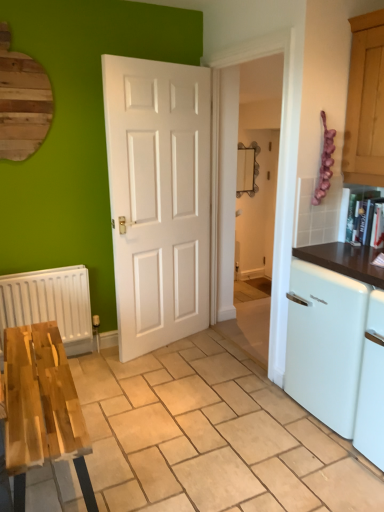
This screenshot has width=384, height=512. Describe the element at coordinates (325, 343) in the screenshot. I see `white glossy dishwasher at right` at that location.

Locate an element on the screen. The width and height of the screenshot is (384, 512). wooden table at lower left is located at coordinates (211, 436).

Locate an element on the screen. white matte radiator at left is located at coordinates (49, 304).

Locate an element on the screen. The height and width of the screenshot is (512, 384). tile that is under the white matte radiator at left (from a real-world perspective) is located at coordinates (211, 436).

Based on the photo, from a real-world perspective, which object stands above the other?

From a 3D spatial view, white matte radiator at left is above.

From the image's perspective, which is above, wooden table at lower left or white matte radiator at left?

white matte radiator at left is shown above in the image.

Is white glossy dishwasher at right bigger or smaller than white matte radiator at left?

In the image, white glossy dishwasher at right appears to be larger than white matte radiator at left.

Looking at this image, who is shorter, white glossy dishwasher at right or white matte radiator at left?

white matte radiator at left.

From the image's perspective, is white glossy dishwasher at right located above or below white matte radiator at left?

Based on their image positions, white glossy dishwasher at right is located beneath white matte radiator at left.

Which is nearer, [349,372] or [19,317]?

Point [349,372] is closer to the camera than point [19,317].

How distant is white matte radiator at left from wooden table at lower left?

The distance of white matte radiator at left from wooden table at lower left is 35.52 inches.

Locate an element on the screen. This screenshot has height=512, width=384. radiator above the wooden table at lower left (from a real-world perspective) is located at coordinates (49, 304).

Considering the relative sizes of white matte radiator at left and wooden table at lower left in the image provided, is white matte radiator at left thinner than wooden table at lower left?

Indeed, white matte radiator at left has a lesser width compared to wooden table at lower left.

How many degrees apart are the facing directions of white matte radiator at left and wooden table at lower left?

The facing directions of white matte radiator at left and wooden table at lower left are 89.3 degrees apart.

Does wooden table at lower left have a greater width compared to white glossy dishwasher at right?

Correct, the width of wooden table at lower left exceeds that of white glossy dishwasher at right.

Is wooden table at lower left oriented towards white glossy dishwasher at right?

No, wooden table at lower left is not oriented towards white glossy dishwasher at right.

The image size is (384, 512). In the image, there is a white glossy dishwasher at right. Find the location of `tile below it (from the image's perspective)`. tile below it (from the image's perspective) is located at coordinates (211, 436).

Considering the positions of points (345, 496) and (344, 420), is point (345, 496) closer to camera compared to point (344, 420)?

Yes.

Where is `dish washer that is above the wooden table at lower left (from the image's perspective)`? dish washer that is above the wooden table at lower left (from the image's perspective) is located at coordinates (325, 343).

Is white glossy dishwasher at right taller than wooden table at lower left?

Indeed, white glossy dishwasher at right has a greater height compared to wooden table at lower left.

Does white glossy dishwasher at right contain wooden table at lower left?

No, wooden table at lower left is not surrounded by white glossy dishwasher at right.

From a real-world perspective, is white glossy dishwasher at right beneath wooden table at lower left?

No.

Find the location of a particular element. Image resolution: width=384 pixels, height=512 pixels. dish washer to the right of white matte radiator at left is located at coordinates 325,343.

From the picture: Which object is closer to the camera taking this photo, white matte radiator at left or white glossy dishwasher at right?

Positioned in front is white glossy dishwasher at right.

How many degrees apart are the facing directions of white matte radiator at left and white glossy dishwasher at right?

white matte radiator at left and white glossy dishwasher at right are facing 90.3 degrees away from each other.

You are a GUI agent. You are given a task and a screenshot of the screen. Output one action in this format:
    pyautogui.click(x=<x>, y=<y>)
    Task: Click on the tile in front of the white matte radiator at left
    
    Given the screenshot: What is the action you would take?
    pyautogui.click(x=211, y=436)

In order to click on radiator on the left of white glossy dishwasher at right in this screenshot , I will do `click(49, 304)`.

When comparing their distances from wooden table at lower left, does white glossy dishwasher at right or white matte radiator at left seem closer?

Among the two, white glossy dishwasher at right is located nearer to wooden table at lower left.

Estimate the real-world distances between objects in this image. Which object is closer to white glossy dishwasher at right, white matte radiator at left or wooden table at lower left?

wooden table at lower left lies closer to white glossy dishwasher at right than the other object.

Based on their spatial positions, is white glossy dishwasher at right or wooden table at lower left closer to white matte radiator at left?

wooden table at lower left is positioned closer to the anchor white matte radiator at left.

Considering their positions, is wooden table at lower left positioned further to white matte radiator at left than white glossy dishwasher at right?

Among the two, white glossy dishwasher at right is located further to white matte radiator at left.

From the image, which object appears to be farther from white glossy dishwasher at right, wooden table at lower left or white matte radiator at left?

white matte radiator at left.

When comparing their distances from wooden table at lower left, does white matte radiator at left or white glossy dishwasher at right seem further?

white matte radiator at left lies further to wooden table at lower left than the other object.

You are a GUI agent. You are given a task and a screenshot of the screen. Output one action in this format:
    pyautogui.click(x=<x>, y=<y>)
    Task: Click on the tile between white matte radiator at left and white glossy dishwasher at right
    The height and width of the screenshot is (512, 384).
    Given the screenshot: What is the action you would take?
    [x=211, y=436]